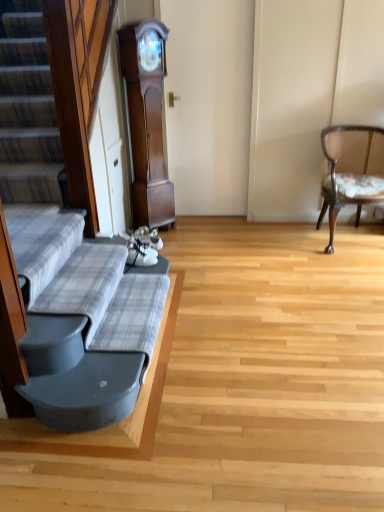
I want to click on empty space that is ontop of plaid fabric couch at left, so click(115, 314).